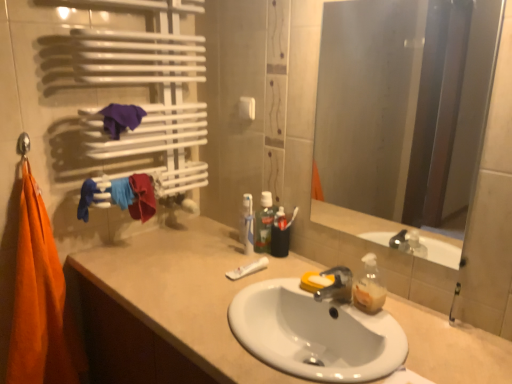
Question: Can you confirm if green translucent mouthwash at center is wider than translucent plastic toothpaste at center?

Choices:
 (A) yes
 (B) no

Answer: (A)

Question: Is green translucent mouthwash at center at the left side of translucent plastic toothpaste at center?

Choices:
 (A) no
 (B) yes

Answer: (A)

Question: Is green translucent mouthwash at center looking in the opposite direction of translucent plastic toothpaste at center?

Choices:
 (A) no
 (B) yes

Answer: (A)

Question: From the image's perspective, is green translucent mouthwash at center below translucent plastic toothpaste at center?

Choices:
 (A) yes
 (B) no

Answer: (B)

Question: Is green translucent mouthwash at center thinner than translucent plastic toothpaste at center?

Choices:
 (A) yes
 (B) no

Answer: (B)

Question: Is green translucent mouthwash at center outside translucent plastic toothpaste at center?

Choices:
 (A) no
 (B) yes

Answer: (B)

Question: From the image's perspective, is purple fabric at upper left, acting as the 2th beach towel starting from the left, under white matte toothpaste at center?

Choices:
 (A) yes
 (B) no

Answer: (B)

Question: Is purple fabric at upper left, the first beach towel positioned from the right, positioned far away from white matte toothpaste at center?

Choices:
 (A) yes
 (B) no

Answer: (B)

Question: Considering the relative sizes of purple fabric at upper left, acting as the 2th beach towel starting from the left, and white matte toothpaste at center in the image provided, is purple fabric at upper left, acting as the 2th beach towel starting from the left, taller than white matte toothpaste at center?

Choices:
 (A) no
 (B) yes

Answer: (B)

Question: Can you confirm if purple fabric at upper left, which ranks as the 1th beach towel in top-to-bottom order, is smaller than white matte toothpaste at center?

Choices:
 (A) no
 (B) yes

Answer: (A)

Question: Is purple fabric at upper left, which ranks as the 1th beach towel in top-to-bottom order, bigger than white matte toothpaste at center?

Choices:
 (A) yes
 (B) no

Answer: (A)

Question: From the image's perspective, would you say purple fabric at upper left, acting as the 2th beach towel starting from the left, is positioned over white matte toothpaste at center?

Choices:
 (A) no
 (B) yes

Answer: (B)

Question: Does beige matte cabinet at lower left come in front of green translucent mouthwash at center?

Choices:
 (A) yes
 (B) no

Answer: (A)